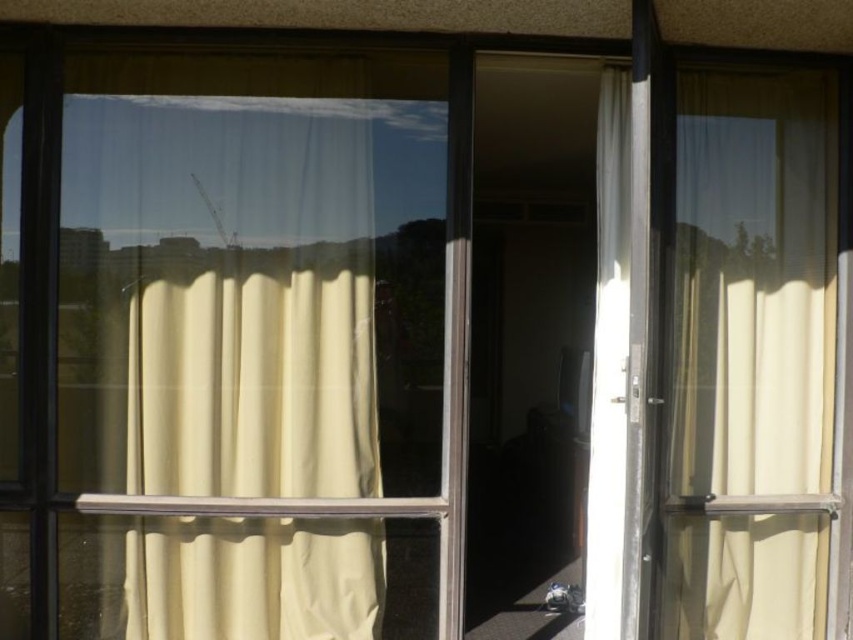
Question: Which object appears farthest from the camera in this image?

Choices:
 (A) white sheer curtain at center
 (B) beige sheer curtain at right

Answer: (B)

Question: Can you confirm if white sheer curtain at left is positioned below beige sheer curtain at right?

Choices:
 (A) yes
 (B) no

Answer: (A)

Question: Observing the image, what is the correct spatial positioning of white sheer curtain at left in reference to beige sheer curtain at right?

Choices:
 (A) above
 (B) below

Answer: (B)

Question: Which point is closer to the camera taking this photo?

Choices:
 (A) (692, 342)
 (B) (628, 170)
 (C) (180, 326)

Answer: (C)

Question: Can you confirm if white sheer curtain at left is positioned above beige sheer curtain at right?

Choices:
 (A) yes
 (B) no

Answer: (B)

Question: Which point is closer to the camera taking this photo?

Choices:
 (A) (619, 516)
 (B) (759, 412)

Answer: (A)